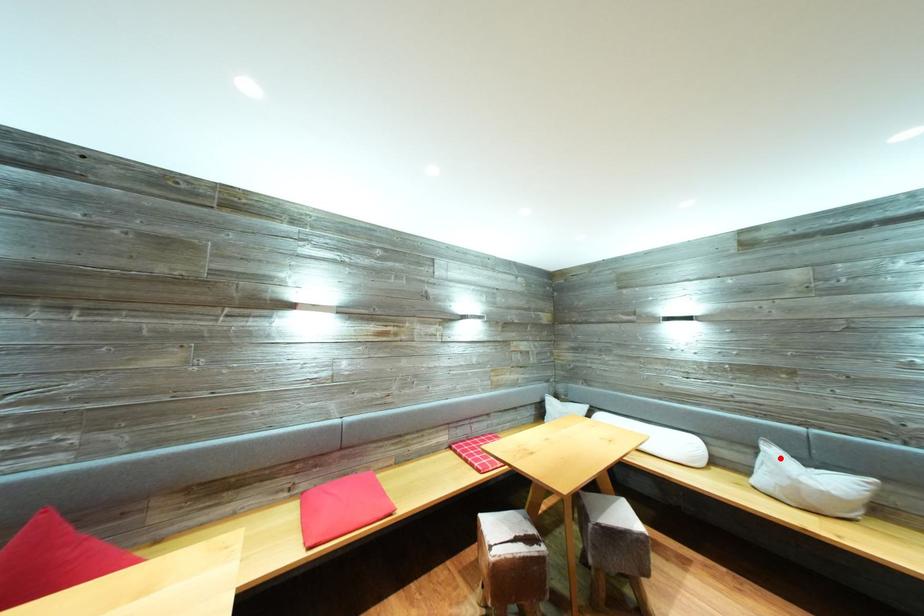
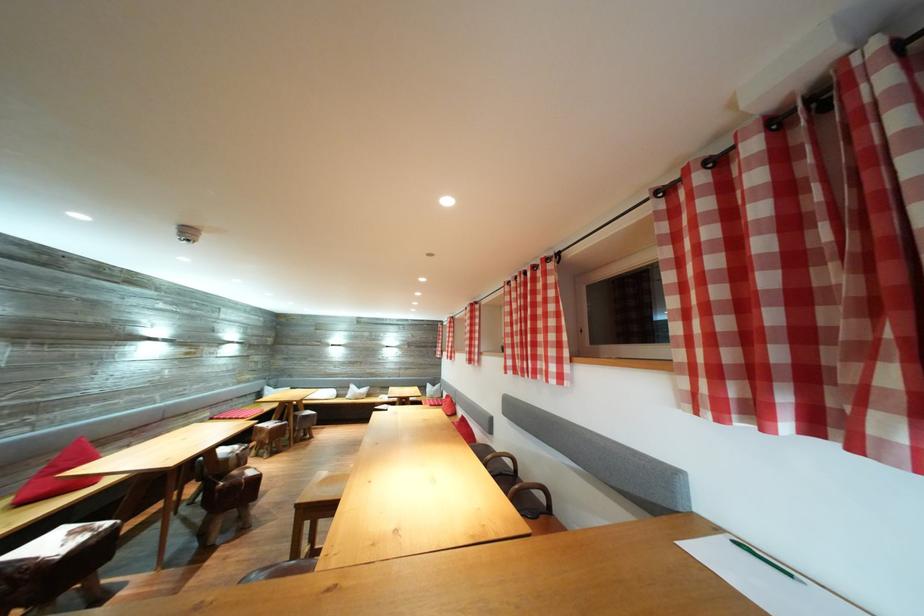
Question: I am providing you with two images of the same scene from different viewpoints. In image1, a red point is highlighted. Considering the same 3D point in image2, which of the following is correct?

Choices:
 (A) It is closer
 (B) It is farther

Answer: (B)